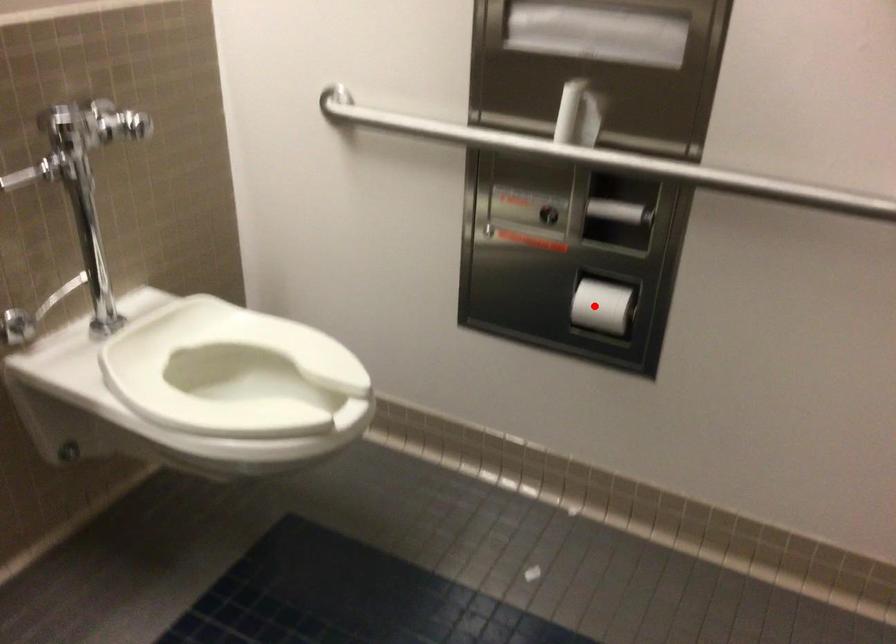
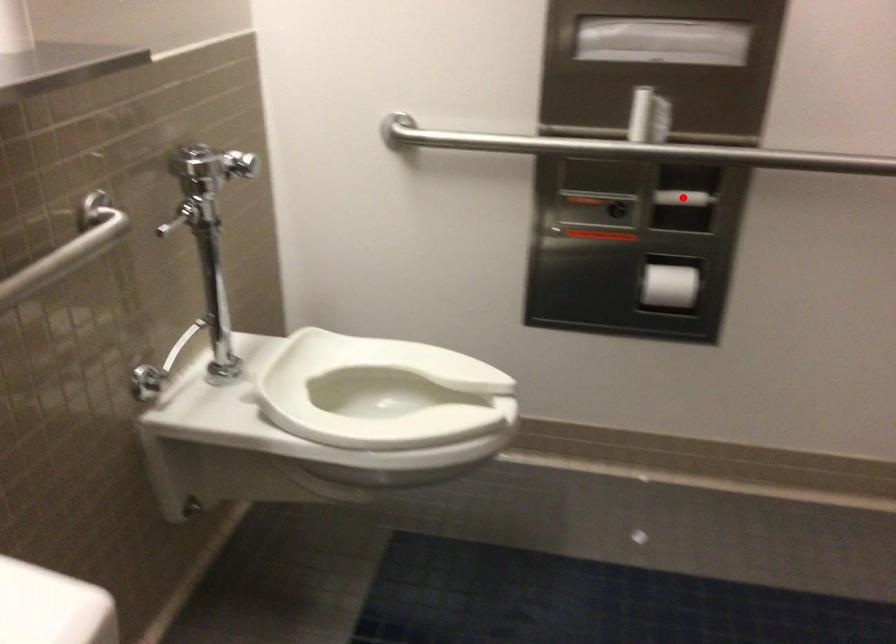
I am providing you with two images of the same scene from different viewpoints. A red point is marked on the first image and another point is marked on the second image. Is the red point in image1 aligned with the point shown in image2?

No